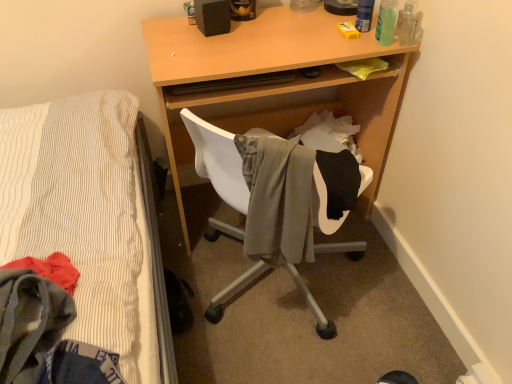
This screenshot has height=384, width=512. Describe the element at coordinates (274, 85) in the screenshot. I see `light wood desk at center` at that location.

The image size is (512, 384). Describe the element at coordinates (408, 23) in the screenshot. I see `clear plastic bottle at upper right, marked as the 1th bottle in a right-to-left arrangement` at that location.

What do you see at coordinates (212, 16) in the screenshot? This screenshot has height=384, width=512. I see `matte black speaker at upper center` at bounding box center [212, 16].

Image resolution: width=512 pixels, height=384 pixels. I want to click on matte black speaker at upper center, so (x=212, y=16).

What is the approximate width of gray fabric chair at center?

gray fabric chair at center is 7.49 inches in width.

Find the location of a particular element. This screenshot has width=512, height=384. gray fabric chair at center is located at coordinates (x=218, y=160).

The height and width of the screenshot is (384, 512). What do you see at coordinates (386, 22) in the screenshot?
I see `green translucent bottle at upper right, arranged as the 2th bottle when viewed from the right` at bounding box center [386, 22].

You are a GUI agent. You are given a task and a screenshot of the screen. Output one action in this format:
    pyautogui.click(x=<x>, y=<y>)
    Task: Click on the translucent plastic bottle at upper right, marked as the 1th bottle in a left-to-right arrangement
    The height and width of the screenshot is (384, 512).
    Given the screenshot: What is the action you would take?
    pos(364,15)

Does translucent plastic bottle at upper right, marked as the 1th bottle in a left-to-right arrangement, have a lesser width compared to clear plastic bottle at upper right, marked as the 1th bottle in a right-to-left arrangement?

Yes, translucent plastic bottle at upper right, marked as the 1th bottle in a left-to-right arrangement, is thinner than clear plastic bottle at upper right, marked as the 1th bottle in a right-to-left arrangement.

Where is `the 2nd bottle counting from the right side of the translucent plastic bottle at upper right, marked as the 1th bottle in a left-to-right arrangement`? This screenshot has width=512, height=384. the 2nd bottle counting from the right side of the translucent plastic bottle at upper right, marked as the 1th bottle in a left-to-right arrangement is located at coordinates (408, 23).

Would you say translucent plastic bottle at upper right, marked as the 1th bottle in a left-to-right arrangement, is to the left or to the right of clear plastic bottle at upper right, marked as the 1th bottle in a right-to-left arrangement, in the picture?

In the image, translucent plastic bottle at upper right, marked as the 1th bottle in a left-to-right arrangement, appears on the left side of clear plastic bottle at upper right, marked as the 1th bottle in a right-to-left arrangement.

Is green translucent bottle at upper right, which is the second bottle from left to right, positioned with its back to matte black speaker at upper center?

No, green translucent bottle at upper right, which is the second bottle from left to right, is not facing the opposite direction of matte black speaker at upper center.

Considering the relative positions of green translucent bottle at upper right, which is the second bottle from left to right, and matte black speaker at upper center in the image provided, is green translucent bottle at upper right, which is the second bottle from left to right, to the left of matte black speaker at upper center from the viewer's perspective?

No, green translucent bottle at upper right, which is the second bottle from left to right, is not to the left of matte black speaker at upper center.

How many degrees apart are the facing directions of green translucent bottle at upper right, arranged as the 2th bottle when viewed from the right, and matte black speaker at upper center?

19.9 degrees.

Which of these two, green translucent bottle at upper right, arranged as the 2th bottle when viewed from the right, or matte black speaker at upper center, is thinner?

Thinner between the two is green translucent bottle at upper right, arranged as the 2th bottle when viewed from the right.

From the picture: From the image's perspective, which one is positioned higher, clear plastic bottle at upper right, marked as the third bottle in a left-to-right arrangement, or matte black speaker at upper center?

matte black speaker at upper center appears higher in the image.

Is point (403, 25) farther from camera compared to point (206, 1)?

That is True.

Considering the positions of objects clear plastic bottle at upper right, marked as the third bottle in a left-to-right arrangement, and matte black speaker at upper center in the image provided, who is more to the left, clear plastic bottle at upper right, marked as the third bottle in a left-to-right arrangement, or matte black speaker at upper center?

matte black speaker at upper center.

Considering the relative sizes of gray fabric chair at center and green translucent bottle at upper right, which is the second bottle from left to right, in the image provided, is gray fabric chair at center taller than green translucent bottle at upper right, which is the second bottle from left to right,?

Yes.

Does gray fabric chair at center lie behind green translucent bottle at upper right, which is the second bottle from left to right?

No, it is not.

Are gray fabric chair at center and green translucent bottle at upper right, arranged as the 2th bottle when viewed from the right, making contact?

No, gray fabric chair at center is not making contact with green translucent bottle at upper right, arranged as the 2th bottle when viewed from the right.

Which object is wider, translucent plastic bottle at upper right, the 3th bottle positioned from the right, or light wood desk at center?

light wood desk at center is wider.

Is translucent plastic bottle at upper right, the 3th bottle positioned from the right, taller or shorter than light wood desk at center?

translucent plastic bottle at upper right, the 3th bottle positioned from the right, is shorter than light wood desk at center.

Is light wood desk at center at the back of translucent plastic bottle at upper right, the 3th bottle positioned from the right?

No, light wood desk at center is not at the back of translucent plastic bottle at upper right, the 3th bottle positioned from the right.

Measure the distance between translucent plastic bottle at upper right, marked as the 1th bottle in a left-to-right arrangement, and light wood desk at center.

translucent plastic bottle at upper right, marked as the 1th bottle in a left-to-right arrangement, and light wood desk at center are 16.40 inches apart.

Between light wood desk at center and translucent plastic bottle at upper right, marked as the 1th bottle in a left-to-right arrangement, which one has smaller size?

translucent plastic bottle at upper right, marked as the 1th bottle in a left-to-right arrangement, is smaller.

Are light wood desk at center and translucent plastic bottle at upper right, the 3th bottle positioned from the right, located far from each other?

No.

From the image's perspective, is light wood desk at center on translucent plastic bottle at upper right, the 3th bottle positioned from the right?

No, from the image's perspective, light wood desk at center is not over translucent plastic bottle at upper right, the 3th bottle positioned from the right.

From a real-world perspective, is translucent plastic bottle at upper right, marked as the 1th bottle in a left-to-right arrangement, positioned above or below green translucent bottle at upper right, arranged as the 2th bottle when viewed from the right?

translucent plastic bottle at upper right, marked as the 1th bottle in a left-to-right arrangement, is above green translucent bottle at upper right, arranged as the 2th bottle when viewed from the right.

Could you tell me if translucent plastic bottle at upper right, the 3th bottle positioned from the right, is facing green translucent bottle at upper right, which is the second bottle from left to right?

Yes, translucent plastic bottle at upper right, the 3th bottle positioned from the right, is facing green translucent bottle at upper right, which is the second bottle from left to right.

Based on the photo, is translucent plastic bottle at upper right, marked as the 1th bottle in a left-to-right arrangement, outside of green translucent bottle at upper right, which is the second bottle from left to right?

Yes.

Can you confirm if translucent plastic bottle at upper right, the 3th bottle positioned from the right, is smaller than green translucent bottle at upper right, arranged as the 2th bottle when viewed from the right?

Yes, translucent plastic bottle at upper right, the 3th bottle positioned from the right, is smaller than green translucent bottle at upper right, arranged as the 2th bottle when viewed from the right.

From a real-world perspective, starting from the translucent plastic bottle at upper right, marked as the 1th bottle in a left-to-right arrangement, which bottle is the 2nd one below it? Please provide its 2D coordinates.

[(408, 23)]

Locate an element on the screen. loudspeaker located on the left of green translucent bottle at upper right, arranged as the 2th bottle when viewed from the right is located at coordinates (212, 16).

Looking at the image, which one is located closer to translucent plastic bottle at upper right, the 3th bottle positioned from the right, matte black speaker at upper center or light wood desk at center?

The object closer to translucent plastic bottle at upper right, the 3th bottle positioned from the right, is light wood desk at center.

Based on their spatial positions, is gray fabric chair at center or translucent plastic bottle at upper right, the 3th bottle positioned from the right, closer to green translucent bottle at upper right, which is the second bottle from left to right?

The object closer to green translucent bottle at upper right, which is the second bottle from left to right, is translucent plastic bottle at upper right, the 3th bottle positioned from the right.

Estimate the real-world distances between objects in this image. Which object is closer to gray fabric chair at center, green translucent bottle at upper right, arranged as the 2th bottle when viewed from the right, or matte black speaker at upper center?

Based on the image, matte black speaker at upper center appears to be nearer to gray fabric chair at center.

Which object lies further to the anchor point green translucent bottle at upper right, arranged as the 2th bottle when viewed from the right, light wood desk at center or gray fabric chair at center?

gray fabric chair at center lies further to green translucent bottle at upper right, arranged as the 2th bottle when viewed from the right, than the other object.

Which object lies further to the anchor point matte black speaker at upper center, translucent plastic bottle at upper right, the 3th bottle positioned from the right, or gray fabric chair at center?

translucent plastic bottle at upper right, the 3th bottle positioned from the right, lies further to matte black speaker at upper center than the other object.

When comparing their distances from gray fabric chair at center, does green translucent bottle at upper right, which is the second bottle from left to right, or light wood desk at center seem closer?

Among the two, light wood desk at center is located nearer to gray fabric chair at center.

Which object lies further to the anchor point translucent plastic bottle at upper right, marked as the 1th bottle in a left-to-right arrangement, gray fabric chair at center or light wood desk at center?

Based on the image, gray fabric chair at center appears to be further to translucent plastic bottle at upper right, marked as the 1th bottle in a left-to-right arrangement.

When comparing their distances from green translucent bottle at upper right, which is the second bottle from left to right, does light wood desk at center or clear plastic bottle at upper right, marked as the 1th bottle in a right-to-left arrangement, seem closer?

clear plastic bottle at upper right, marked as the 1th bottle in a right-to-left arrangement, lies closer to green translucent bottle at upper right, which is the second bottle from left to right, than the other object.

This screenshot has height=384, width=512. In order to click on desk between matte black speaker at upper center and green translucent bottle at upper right, arranged as the 2th bottle when viewed from the right in this screenshot , I will do `click(274, 85)`.

The height and width of the screenshot is (384, 512). What are the coordinates of `desk between translucent plastic bottle at upper right, marked as the 1th bottle in a left-to-right arrangement, and gray fabric chair at center, in the vertical direction` in the screenshot? It's located at (274, 85).

Find the location of `bottle between green translucent bottle at upper right, which is the second bottle from left to right, and gray fabric chair at center in the up-down direction`. bottle between green translucent bottle at upper right, which is the second bottle from left to right, and gray fabric chair at center in the up-down direction is located at coordinates (408, 23).

At what (x,y) coordinates should I click in order to perform the action: click on desk between matte black speaker at upper center and clear plastic bottle at upper right, marked as the third bottle in a left-to-right arrangement, in the horizontal direction. Please return your answer as a coordinate pair (x, y). The height and width of the screenshot is (384, 512). Looking at the image, I should click on (274, 85).